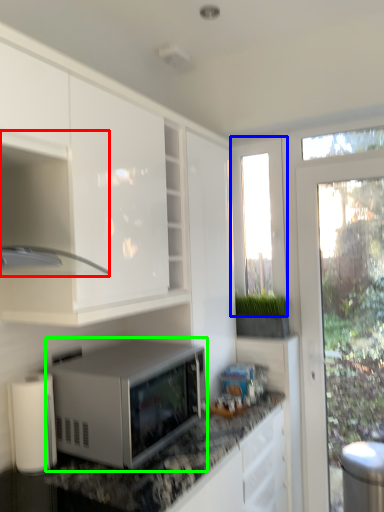
Question: Based on their relative distances, which object is nearer to cabinetry (highlighted by a red box)? Choose from window screen (highlighted by a blue box) and microwave oven (highlighted by a green box).

Choices:
 (A) window screen
 (B) microwave oven

Answer: (B)